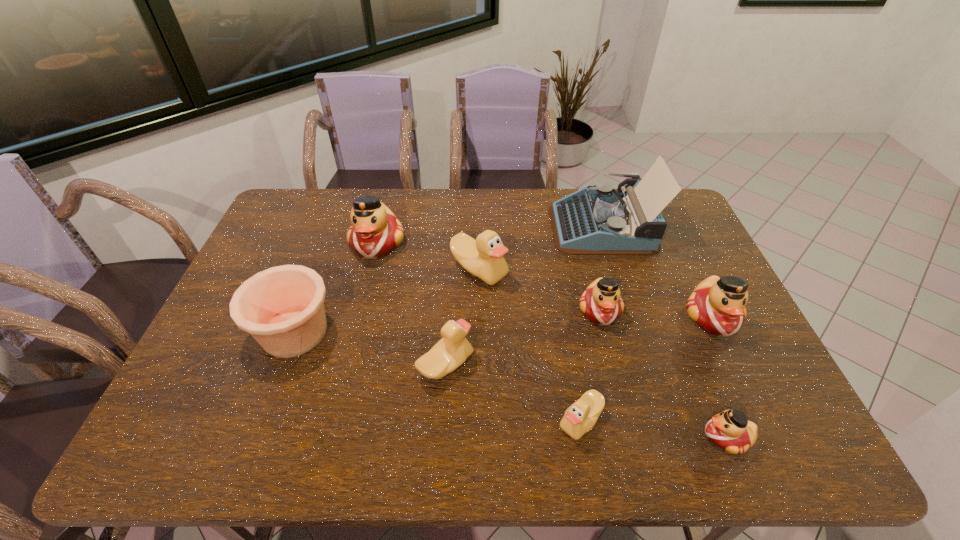
You are a GUI agent. You are given a task and a screenshot of the screen. Output one action in this format:
    pyautogui.click(x=<x>, y=<y>)
    Task: Click on the typewriter
    Image resolution: width=960 pixels, height=540 pixels.
    Given the screenshot: What is the action you would take?
    pyautogui.click(x=591, y=221)

I want to click on the leftmost duck, so click(375, 231).

Locate an element on the screen. This screenshot has height=540, width=960. the biggest red duck is located at coordinates (375, 231).

The width and height of the screenshot is (960, 540). In order to click on the farthest beige duck in this screenshot , I will do (x=483, y=257).

Find the location of `the third smallest red duck`. the third smallest red duck is located at coordinates (717, 305).

Where is `pottery`? This screenshot has width=960, height=540. pottery is located at coordinates (282, 307).

Find the location of `the second smallest beige duck`. the second smallest beige duck is located at coordinates (450, 352).

You are a GUI agent. You are given a task and a screenshot of the screen. Output one action in this format:
    pyautogui.click(x=<x>, y=<y>)
    Task: Click on the third biggest red duck
    This screenshot has height=540, width=960.
    Given the screenshot: What is the action you would take?
    pyautogui.click(x=601, y=302)

This screenshot has width=960, height=540. In order to click on the smallest beige duck in this screenshot , I will do `click(579, 418)`.

Find the location of a particular element. This screenshot has width=960, height=540. the rightmost beige duck is located at coordinates (579, 418).